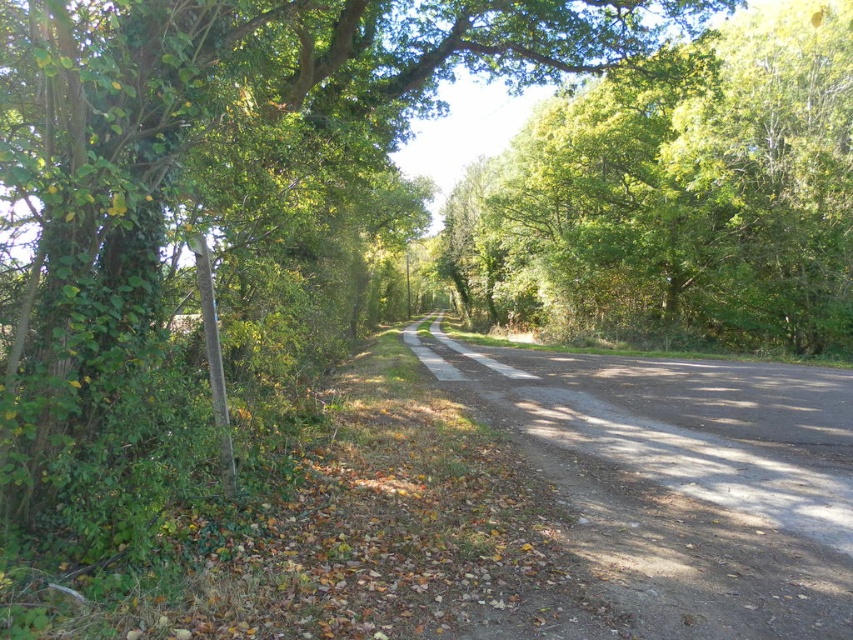
Where is the green leafy tree at left located in the image?

The green leafy tree at left is located at point (x=223, y=170) in the image.